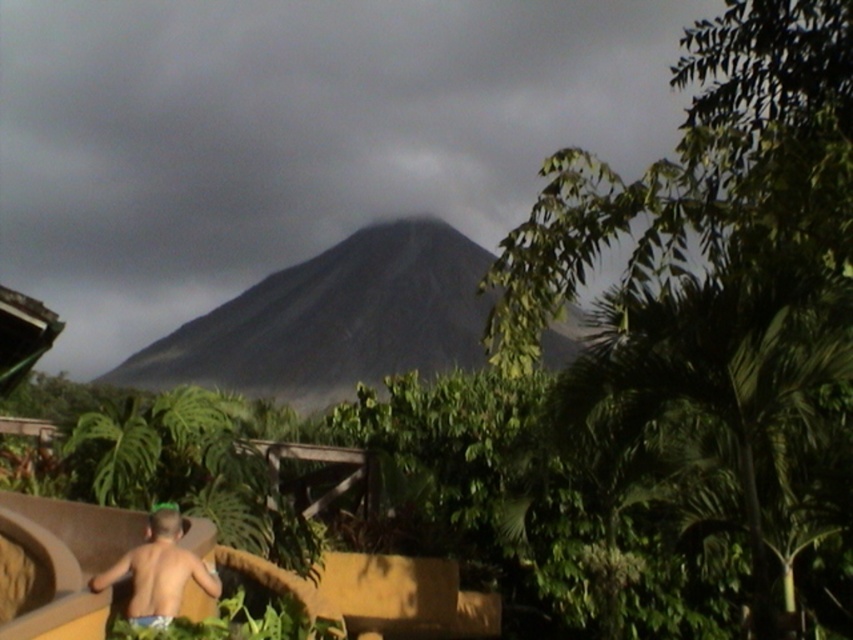
Measure the distance from dark gray volcanic rock at center to light blue fabric at lower left.

dark gray volcanic rock at center and light blue fabric at lower left are 25.49 meters apart from each other.

Between dark gray volcanic rock at center and light blue fabric at lower left, which one is positioned higher?

dark gray volcanic rock at center

Who is more distant from viewer, [260,323] or [117,579]?

Positioned behind is point [260,323].

Find the location of a particular element. dark gray volcanic rock at center is located at coordinates (334, 320).